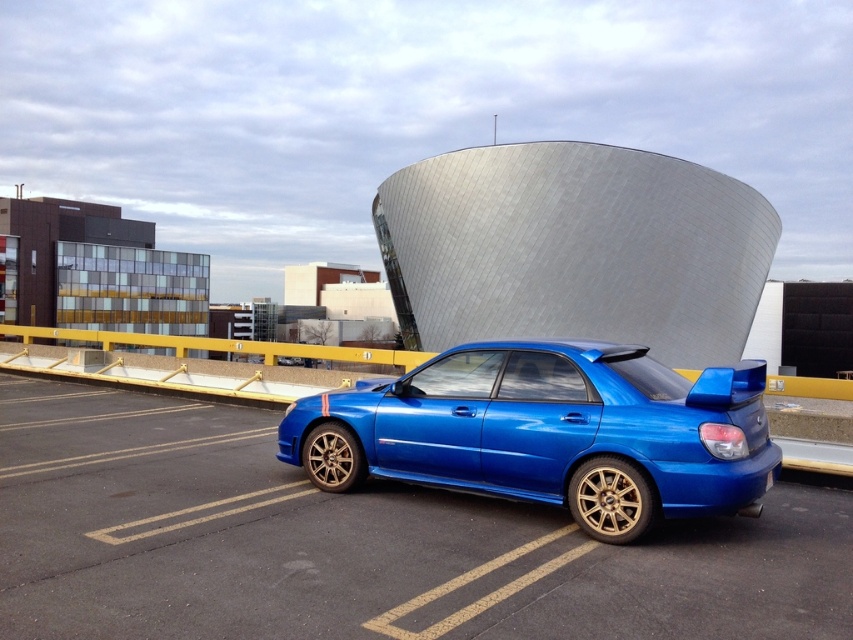
Which is in front, point (16, 529) or point (312, 435)?

Point (16, 529) is in front.

Who is positioned more to the left, metallic blue car at center or glossy blue car at center?

metallic blue car at center is more to the left.

Is point (213, 474) more distant than point (519, 381)?

Yes, point (213, 474) is farther from viewer.

Locate an element on the screen. This screenshot has width=853, height=640. metallic blue car at center is located at coordinates (358, 545).